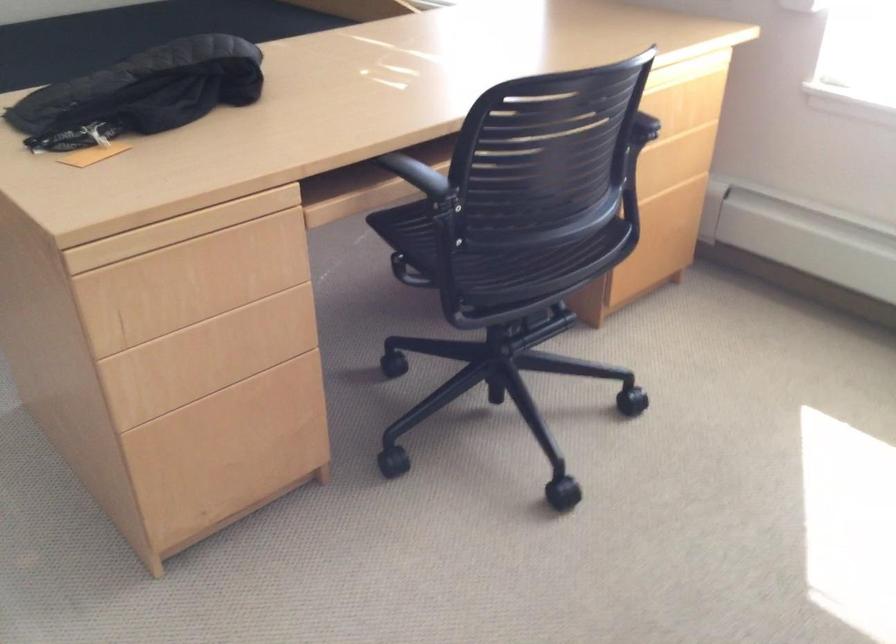
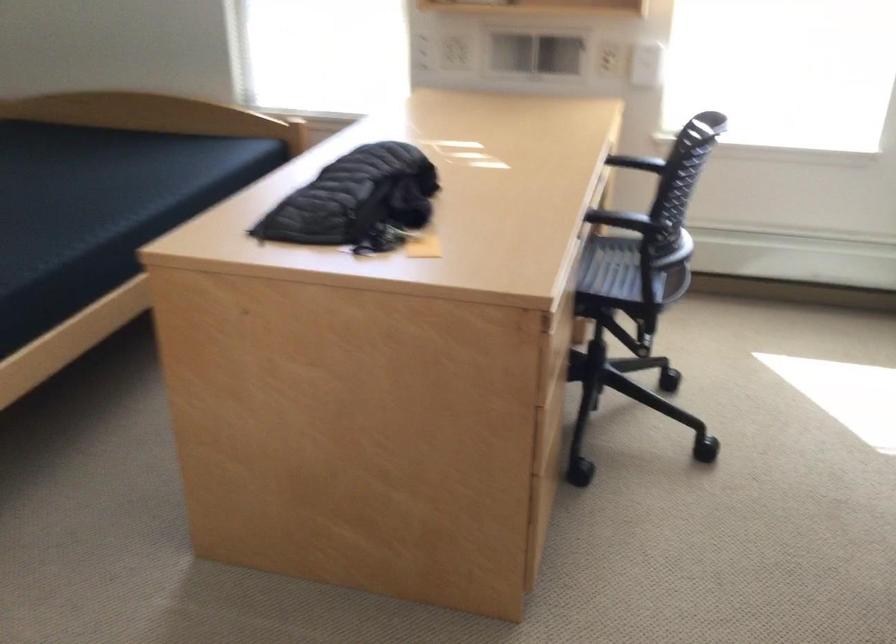
Question: I am providing you with two images of the same scene from different viewpoints. After the viewpoint changes to image2, which objects are now occluded?

Choices:
 (A) black chair armrest
 (B) small condiment jar
 (C) yellow sticky note
 (D) chair sitting surface

Answer: (A)